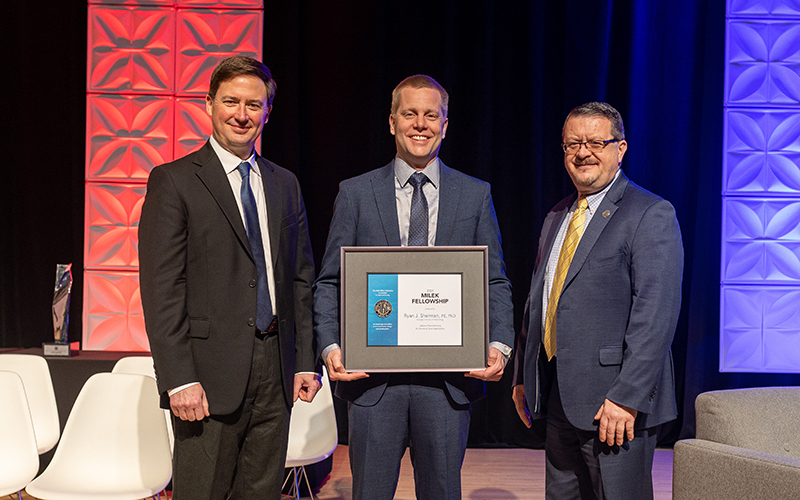
I want to click on white chairs, so click(x=96, y=422), click(x=20, y=430), click(x=33, y=405), click(x=134, y=368), click(x=308, y=429).